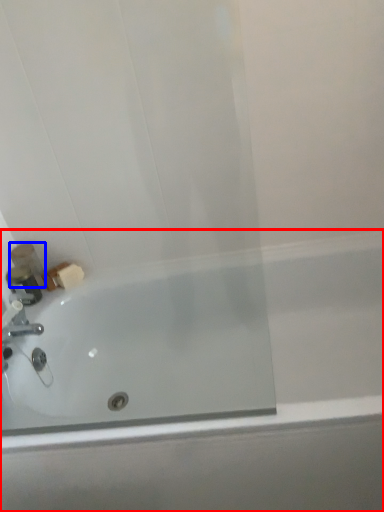
Question: Which object is further to the camera taking this photo, bathtub (highlighted by a red box) or toiletry (highlighted by a blue box)?

Choices:
 (A) bathtub
 (B) toiletry

Answer: (B)